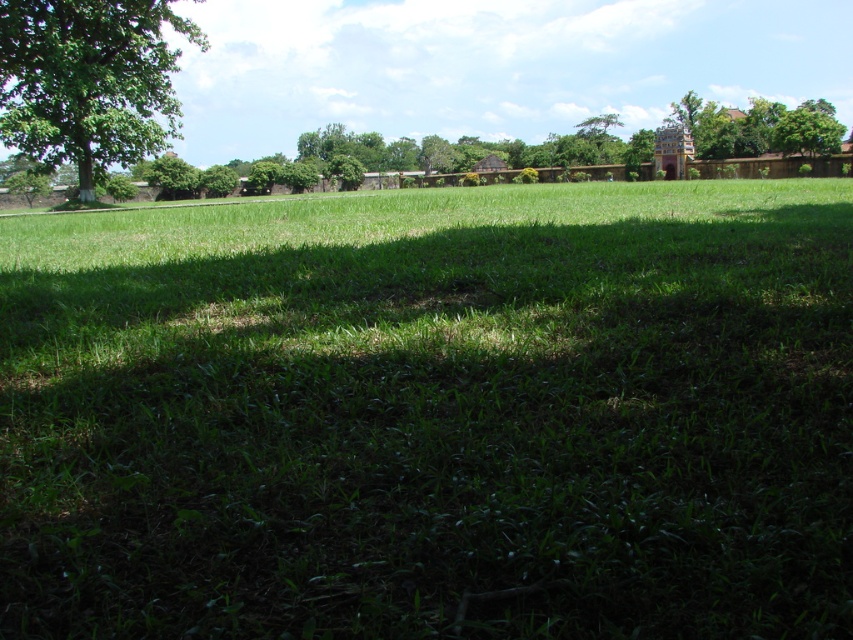
How far apart are green grassy field at center and green leafy tree at upper left?

They are 12.63 meters apart.

The image size is (853, 640). Find the location of `green grassy field at center`. green grassy field at center is located at coordinates (432, 413).